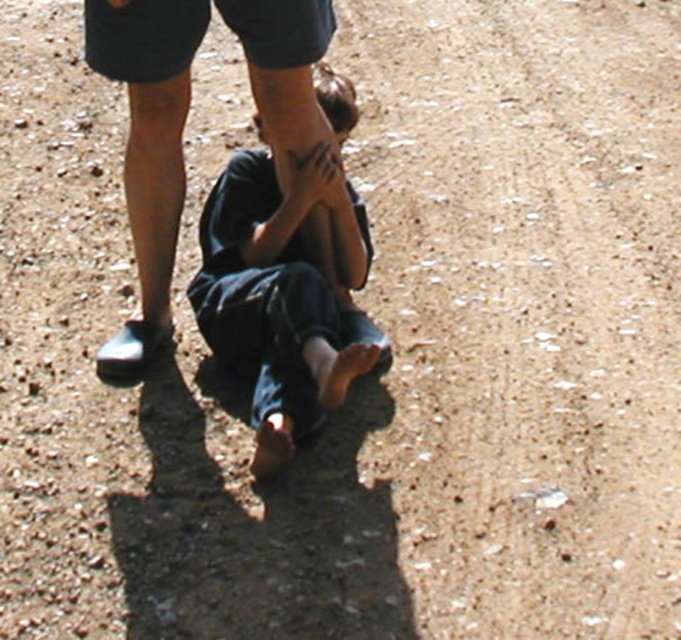
Question: Does dark blue jeans at center appear over dark blue jeans at lower center?

Choices:
 (A) yes
 (B) no

Answer: (B)

Question: Which point is closer to the camera taking this photo?

Choices:
 (A) (321, 115)
 (B) (285, 458)

Answer: (B)

Question: Is dark blue jeans at center above dark blue jeans at lower center?

Choices:
 (A) no
 (B) yes

Answer: (A)

Question: Does dark blue jeans at center have a larger size compared to dark blue jeans at lower center?

Choices:
 (A) no
 (B) yes

Answer: (B)

Question: Among these objects, which one is farthest from the camera?

Choices:
 (A) dark blue jeans at center
 (B) dark blue jeans at lower center

Answer: (B)